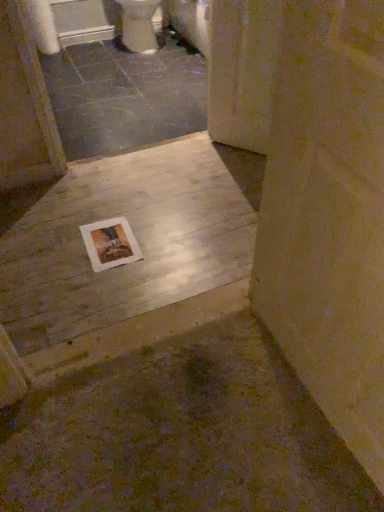
Identify the location of free region on the left part of wooden screen door at upper right. The image size is (384, 512). (201, 151).